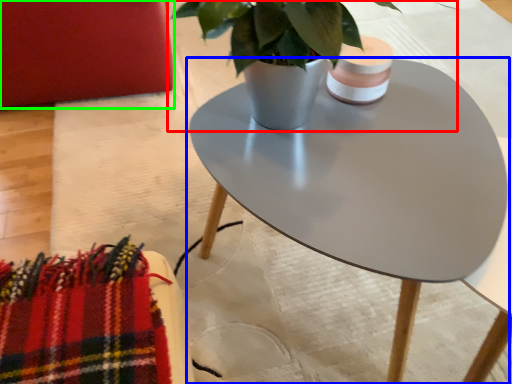
Question: Considering the real-world distances, which object is farthest from houseplant (highlighted by a red box)? coffee table (highlighted by a blue box) or armchair (highlighted by a green box)?

Choices:
 (A) coffee table
 (B) armchair

Answer: (B)